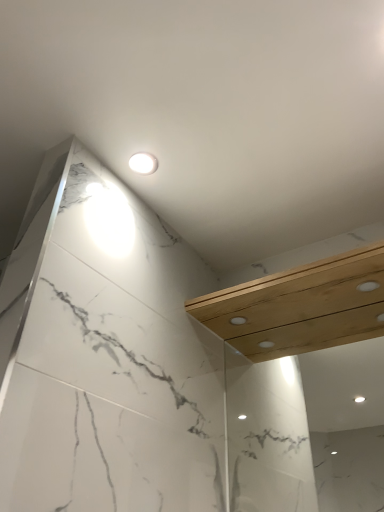
Question: Is white glossy light fixture at upper center beside natural wood balustrade at upper right?

Choices:
 (A) no
 (B) yes

Answer: (A)

Question: Is natural wood balustrade at upper right completely or partially inside white glossy light fixture at upper center?

Choices:
 (A) yes
 (B) no

Answer: (B)

Question: Is white glossy light fixture at upper center smaller than natural wood balustrade at upper right?

Choices:
 (A) no
 (B) yes

Answer: (B)

Question: Is white glossy light fixture at upper center shorter than natural wood balustrade at upper right?

Choices:
 (A) no
 (B) yes

Answer: (B)

Question: Is white glossy light fixture at upper center at the right side of natural wood balustrade at upper right?

Choices:
 (A) no
 (B) yes

Answer: (A)

Question: Is white glossy light fixture at upper center far away from natural wood balustrade at upper right?

Choices:
 (A) no
 (B) yes

Answer: (A)

Question: Can you confirm if natural wood balustrade at upper right is shorter than white glossy light fixture at upper center?

Choices:
 (A) yes
 (B) no

Answer: (B)

Question: From the image's perspective, is natural wood balustrade at upper right beneath white glossy light fixture at upper center?

Choices:
 (A) no
 (B) yes

Answer: (B)

Question: Considering the relative sizes of natural wood balustrade at upper right and white glossy light fixture at upper center in the image provided, is natural wood balustrade at upper right smaller than white glossy light fixture at upper center?

Choices:
 (A) yes
 (B) no

Answer: (B)

Question: Is the position of natural wood balustrade at upper right more distant than that of white glossy light fixture at upper center?

Choices:
 (A) yes
 (B) no

Answer: (B)

Question: Does natural wood balustrade at upper right have a lesser width compared to white glossy light fixture at upper center?

Choices:
 (A) yes
 (B) no

Answer: (B)

Question: Does natural wood balustrade at upper right appear on the right side of white glossy light fixture at upper center?

Choices:
 (A) no
 (B) yes

Answer: (B)

Question: Based on their sizes in the image, would you say natural wood balustrade at upper right is bigger or smaller than white glossy light fixture at upper center?

Choices:
 (A) big
 (B) small

Answer: (A)